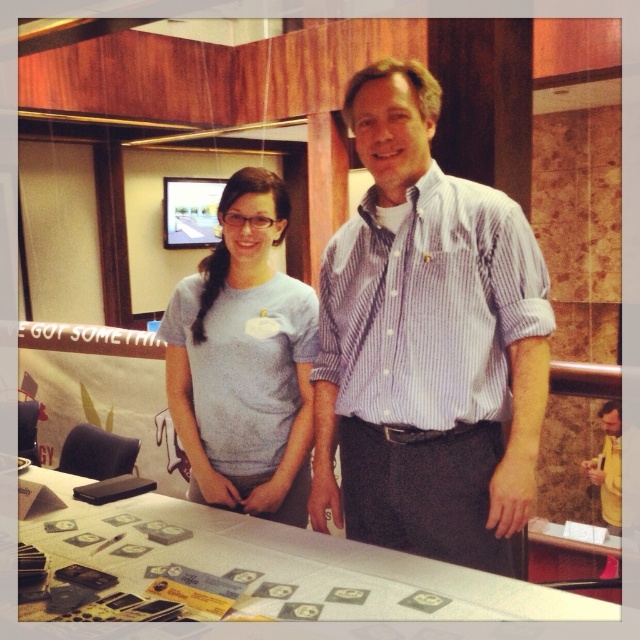
Question: Which point is farther to the camera?

Choices:
 (A) (307, 474)
 (B) (236, 595)

Answer: (A)

Question: Among these objects, which one is nearest to the camera?

Choices:
 (A) white paper at center
 (B) gray matte t-shirt at center

Answer: (A)

Question: Estimate the real-world distances between objects in this image. Which object is closer to the gray matte t-shirt at center?

Choices:
 (A) striped cotton shirt at center
 (B) white paper at center

Answer: (A)

Question: Does white paper at center appear under gray matte t-shirt at center?

Choices:
 (A) yes
 (B) no

Answer: (A)

Question: Can you confirm if striped cotton shirt at center is thinner than gray matte t-shirt at center?

Choices:
 (A) no
 (B) yes

Answer: (A)

Question: Is striped cotton shirt at center positioned behind gray matte t-shirt at center?

Choices:
 (A) yes
 (B) no

Answer: (B)